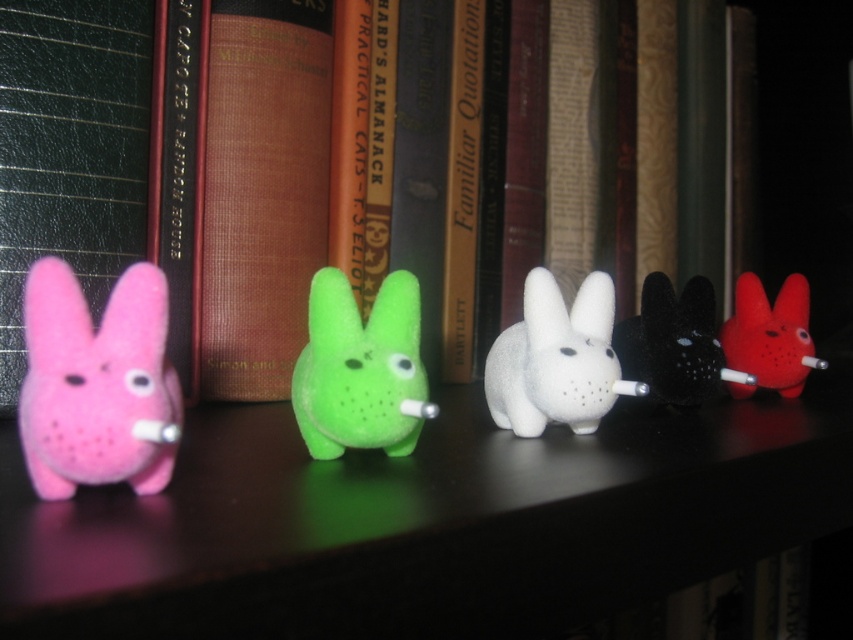
You are a librarian organizing the shelf and need to place a new book. The book must be placed exactly at the 2D coordinate point where the green fuzzy bunny at center is located. What are the coordinates where you should place the book?

The green fuzzy bunny at center is located at the 2D coordinate point of [358,368], so you should place the book at those coordinates.

Consider the image. You are organizing a shelf in a library and need to place a new book that is 12 inches wide. You see the green fuzzy bunny at center and the black fuzzy bunny at center. Can the new book fit between them?

The green fuzzy bunny at center and black fuzzy bunny at center are 12.12 inches apart, so the new book that is 12 inches wide can fit between them since the space is slightly larger than the book.